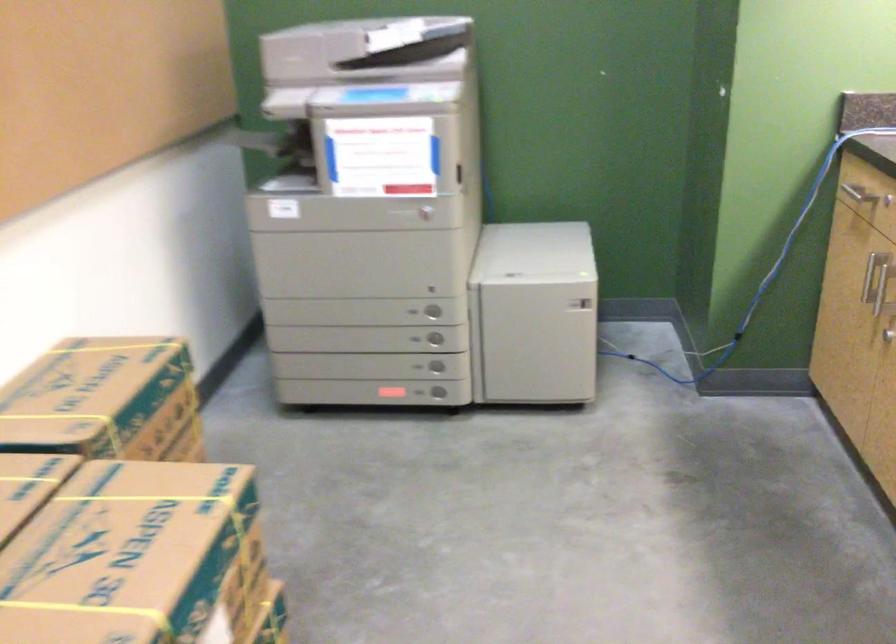
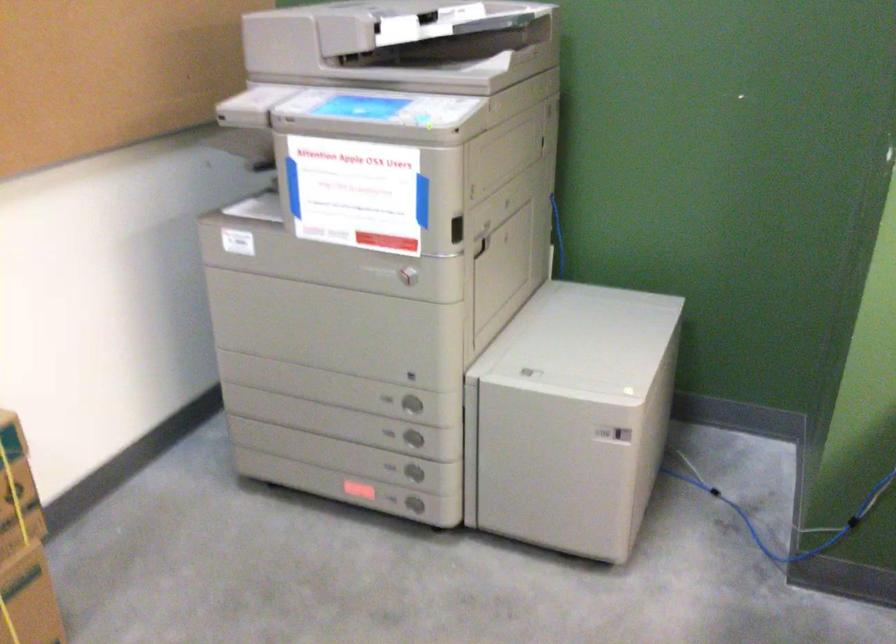
The point at (440, 393) is marked in the first image. Where is the corresponding point in the second image?

(414, 505)